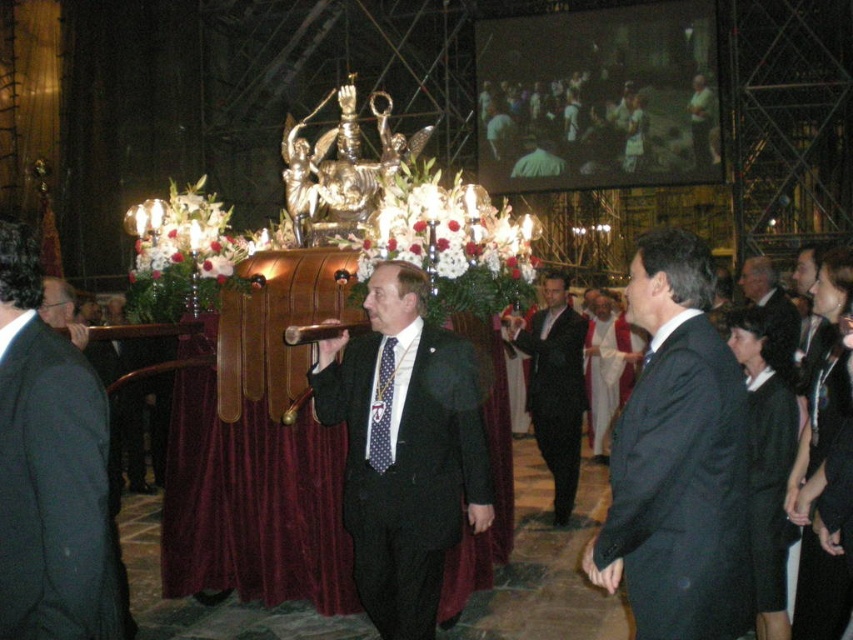
You are a photographer at the event and need to capture a closeup of the dark gray suit at center and the polka dot silk tie at center. Since your camera can only focus on one object at a time, which one should you choose to ensure the other is still in the frame?

A: The dark gray suit at center is bigger than the polka dot silk tie at center, so you should focus on the dark gray suit at center to ensure the smaller polka dot silk tie at center remains in the frame.

You are an event planner observing the solemn procession in the cathedral. You need to determine the spatial relationship between the dark gray suit at center and the polka dot silk tie at center. Which one is taller?

The dark gray suit at center is taller than the polka dot silk tie at center.